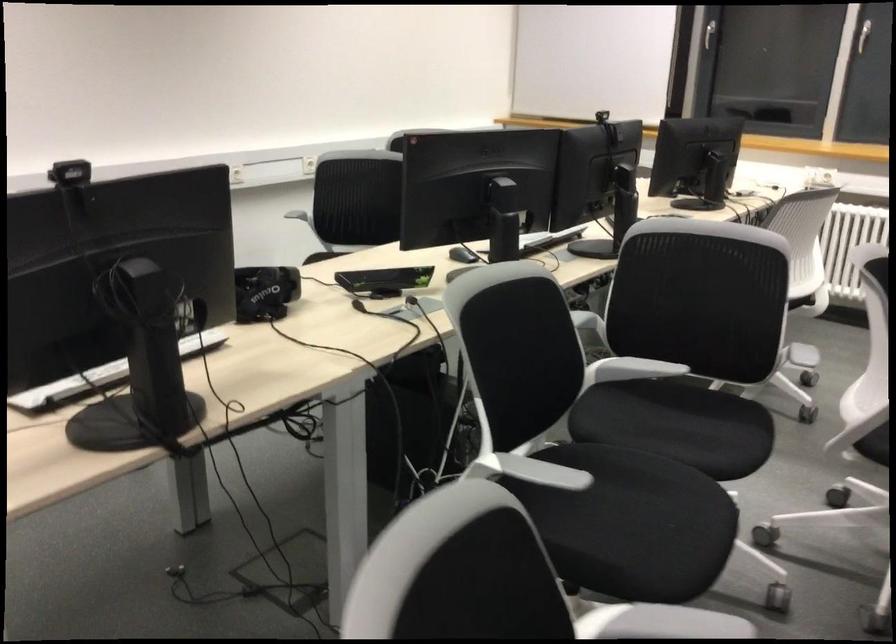
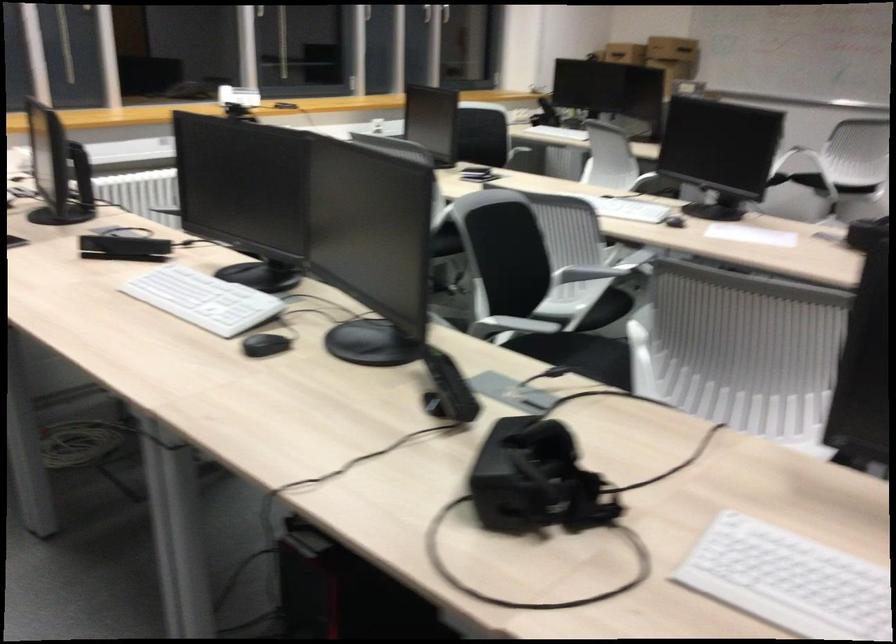
The point at (734, 297) is marked in the first image. Where is the corresponding point in the second image?

(510, 257)